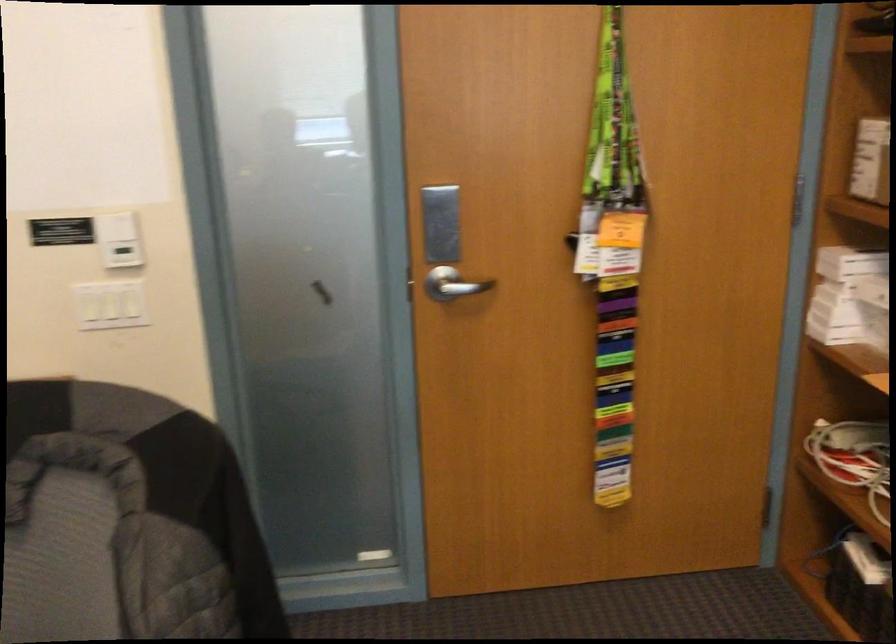
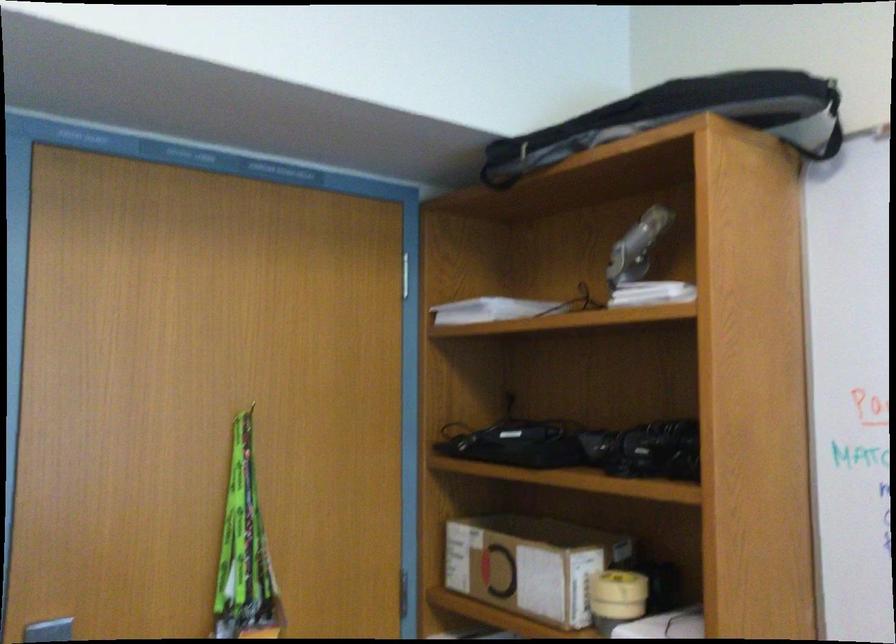
Find the pixel in the second image that matches (609,142) in the first image.

(244, 547)